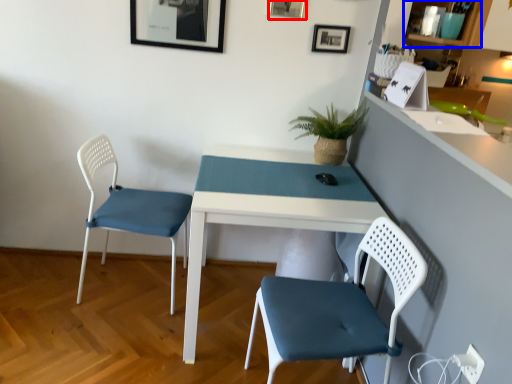
Question: Among these objects, which one is farthest to the camera, picture frame (highlighted by a red box) or shelf (highlighted by a blue box)?

Choices:
 (A) picture frame
 (B) shelf

Answer: (A)